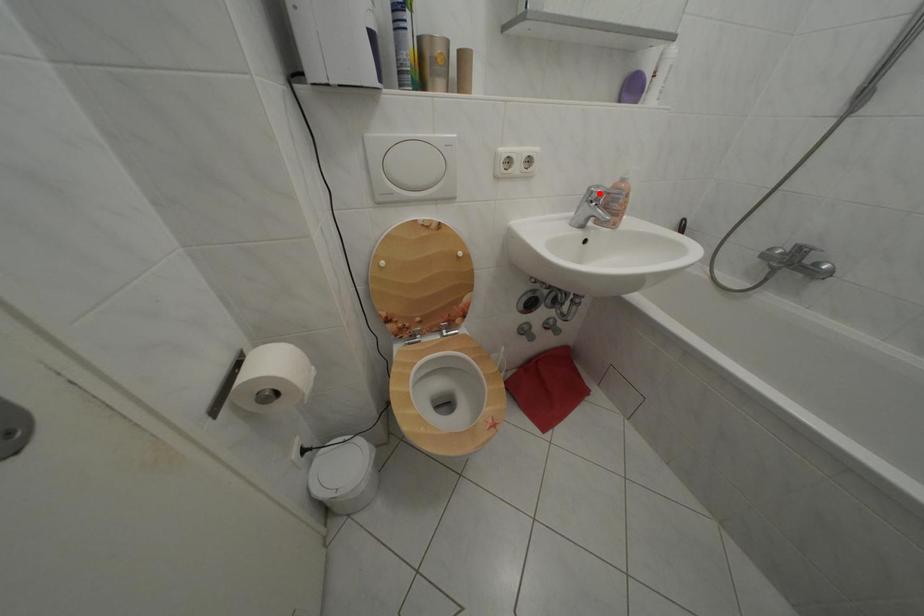
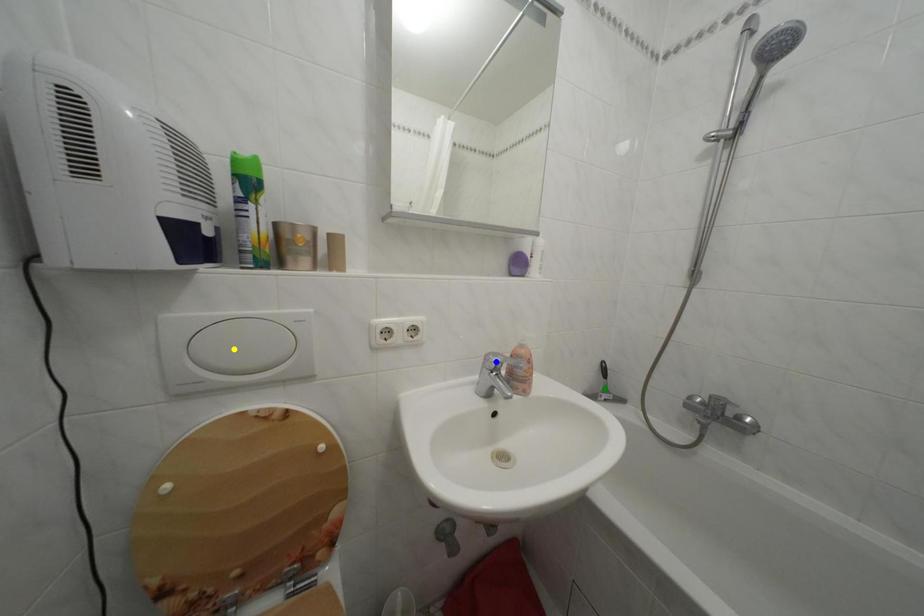
Question: I am providing you with two images of the same scene from different viewpoints. A red point is marked on the first image. You are given multiple points on the second image. In image 2, which mark is for the same physical point as the one in image 1?

Choices:
 (A) yellow point
 (B) blue point
 (C) green point

Answer: (B)